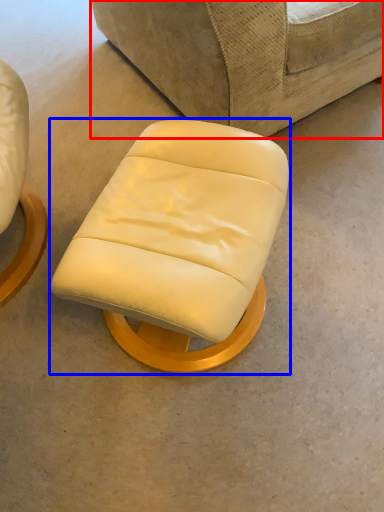
Question: Which object appears farthest to the camera in this image, studio couch (highlighted by a red box) or chair (highlighted by a blue box)?

Choices:
 (A) studio couch
 (B) chair

Answer: (A)